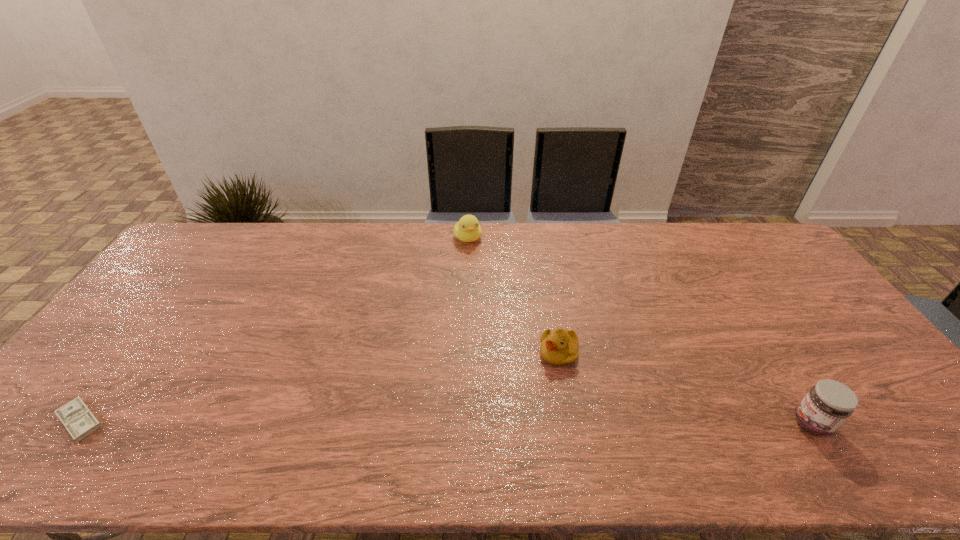
The width and height of the screenshot is (960, 540). I want to click on money, so click(x=80, y=422).

The width and height of the screenshot is (960, 540). What are the coordinates of `the leftmost object` in the screenshot? It's located at (80, 422).

I want to click on the rightmost object, so click(x=829, y=403).

At what (x,y) coordinates should I click in order to perform the action: click on the right duckling. Please return your answer as a coordinate pair (x, y). Looking at the image, I should click on (560, 347).

Locate an element on the screen. the second object from right to left is located at coordinates (560, 347).

You are a GUI agent. You are given a task and a screenshot of the screen. Output one action in this format:
    pyautogui.click(x=<x>, y=<y>)
    Task: Click on the farthest object
    Image resolution: width=960 pixels, height=540 pixels.
    Given the screenshot: What is the action you would take?
    pyautogui.click(x=468, y=229)

At what (x,y) coordinates should I click in order to perform the action: click on the third object from right to left. Please return your answer as a coordinate pair (x, y). The image size is (960, 540). Looking at the image, I should click on (468, 229).

Identify the location of vacant space located 0.280m on the right of the money. The image size is (960, 540). (225, 421).

Locate an element on the screen. This screenshot has height=540, width=960. vacant space located 0.290m on the front label of the jam is located at coordinates (671, 423).

Locate an element on the screen. The image size is (960, 540). vacant area situated on the front label of the jam is located at coordinates (738, 423).